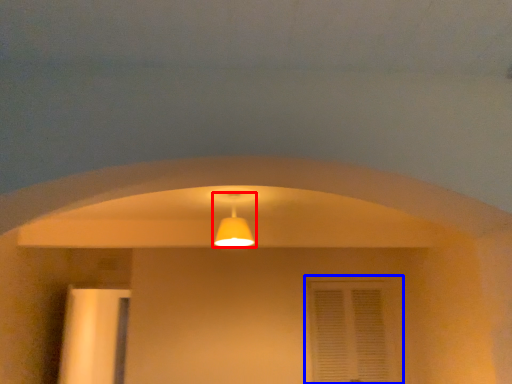
Question: Among these objects, which one is nearest to the camera, lamp (highlighted by a red box) or window (highlighted by a blue box)?

Choices:
 (A) lamp
 (B) window

Answer: (A)